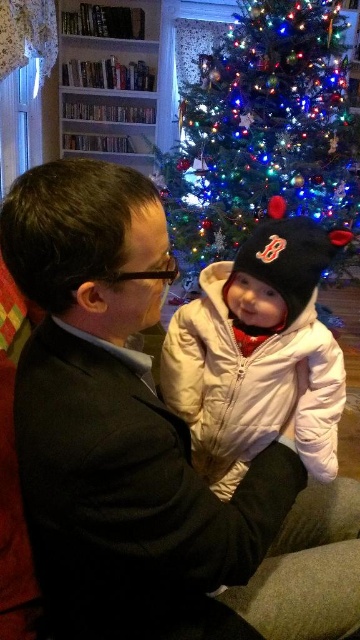
Question: In this image, where is dark suit at center located relative to white puffy coat at center?

Choices:
 (A) left
 (B) right

Answer: (A)

Question: Does iridescent plastic christmas tree at upper center have a greater width compared to white puffy coat at center?

Choices:
 (A) yes
 (B) no

Answer: (A)

Question: Is dark suit at center to the left of white puffy coat at center from the viewer's perspective?

Choices:
 (A) no
 (B) yes

Answer: (B)

Question: Considering the real-world distances, which object is farthest from the iridescent plastic christmas tree at upper center?

Choices:
 (A) white puffy coat at center
 (B) dark suit at center

Answer: (B)

Question: Which object is closer to the camera taking this photo?

Choices:
 (A) white puffy coat at center
 (B) iridescent plastic christmas tree at upper center
 (C) dark suit at center

Answer: (C)

Question: Which point is farther to the camera?

Choices:
 (A) iridescent plastic christmas tree at upper center
 (B) dark suit at center

Answer: (A)